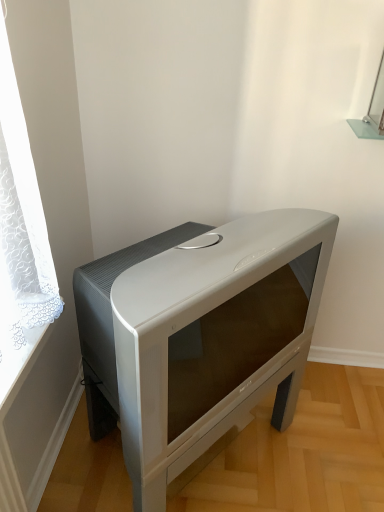
Find the location of a particular element. Image resolution: width=384 pixels, height=512 pixels. white matte television at center is located at coordinates (199, 336).

What do you see at coordinates (199, 336) in the screenshot? This screenshot has height=512, width=384. I see `white matte television at center` at bounding box center [199, 336].

In order to click on white matte television at center in this screenshot , I will do (x=199, y=336).